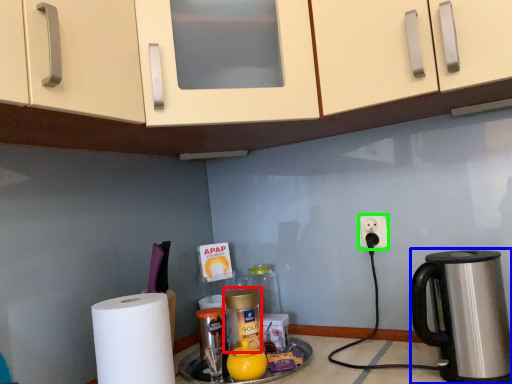
Question: Based on their relative distances, which object is nearer to bottle (highlighted by a red box)? Choose from coffeepot (highlighted by a blue box) and power outlet (highlighted by a green box).

Choices:
 (A) coffeepot
 (B) power outlet

Answer: (B)